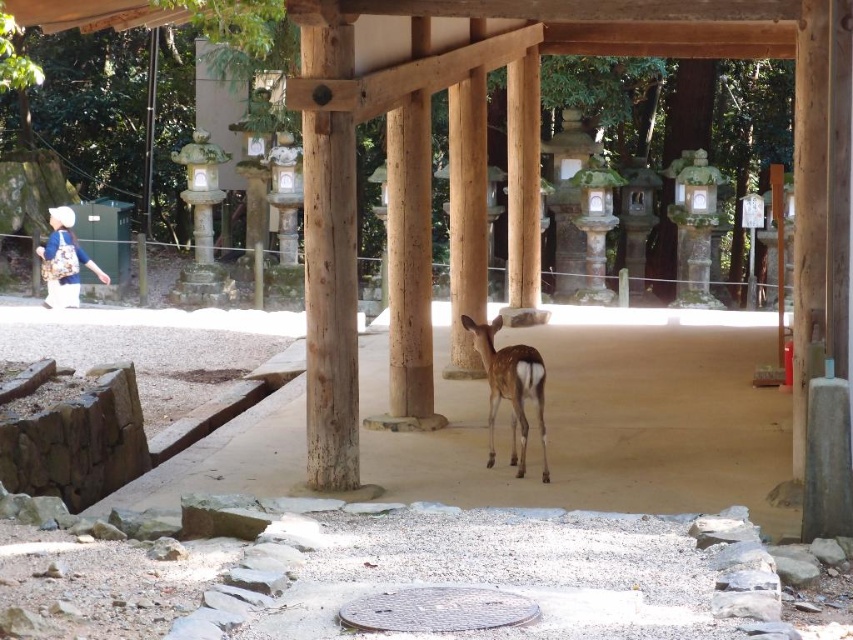
You are standing at the entrance of the shrine and see the point marked at coordinates (329, 262). What object is located at that point?

The point at coordinates (329, 262) indicates the natural wood pillar at center.